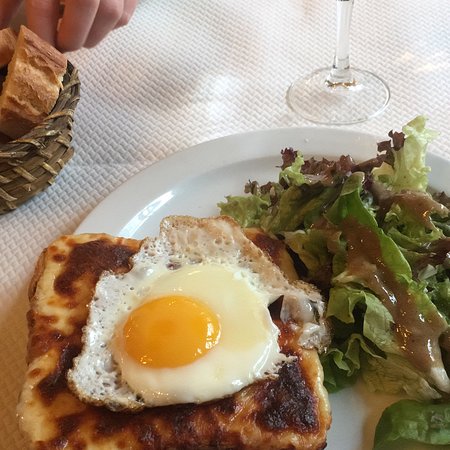
Where is `glass stem`? This screenshot has width=450, height=450. glass stem is located at coordinates (344, 19).